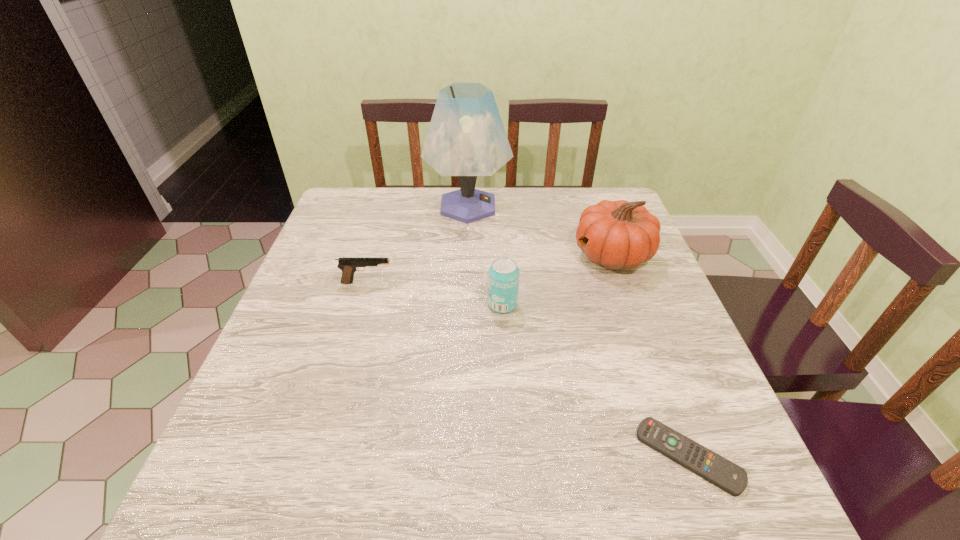
Where is `the farthest object`? the farthest object is located at coordinates (466, 138).

In order to click on lampshade in this screenshot , I will do `click(466, 138)`.

In order to click on the second tallest object in this screenshot , I will do `click(619, 234)`.

At what (x,y) coordinates should I click in order to perform the action: click on the second nearest object. Please return your answer as a coordinate pair (x, y). Looking at the image, I should click on (503, 281).

Identify the location of beer can. (503, 281).

Identify the location of the leftmost object. (349, 266).

Where is `the fourth tallest object`? The width and height of the screenshot is (960, 540). the fourth tallest object is located at coordinates (349, 266).

Find the location of a particular element. This screenshot has width=960, height=540. remote control is located at coordinates (728, 476).

Identify the location of the nearest object. The width and height of the screenshot is (960, 540). (728, 476).

Where is `vacant space located 0.280m on the base of the farthest object`? The width and height of the screenshot is (960, 540). vacant space located 0.280m on the base of the farthest object is located at coordinates (602, 206).